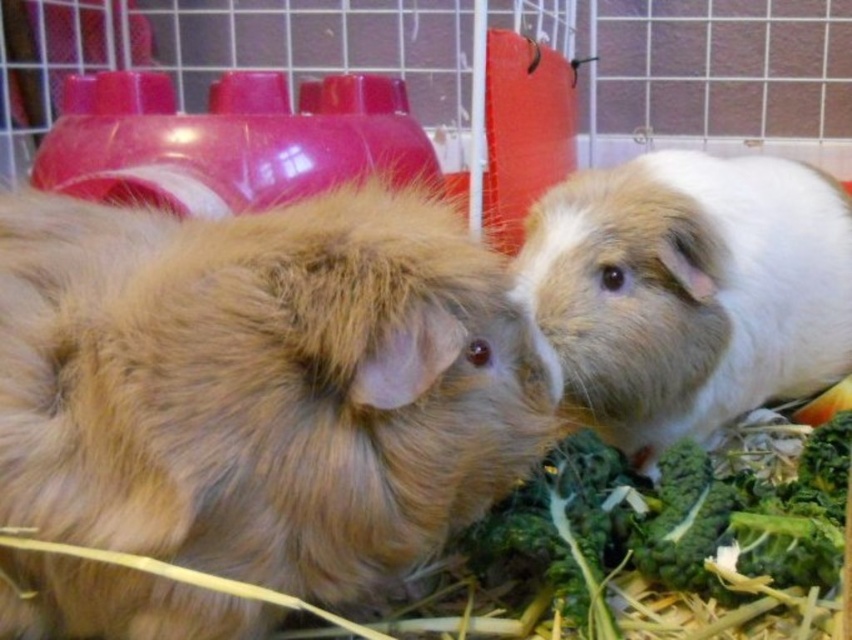
Between fuzzy brown hamster at center and green leafy broccoli at lower right, which one appears on the right side from the viewer's perspective?

Positioned to the right is green leafy broccoli at lower right.

Between fuzzy brown hamster at center and green leafy broccoli at lower right, which one is positioned lower?

green leafy broccoli at lower right is lower down.

The height and width of the screenshot is (640, 852). Describe the element at coordinates (263, 384) in the screenshot. I see `fuzzy brown hamster at center` at that location.

The image size is (852, 640). I want to click on fuzzy brown hamster at center, so click(263, 384).

Does point (547, 259) lie behind point (721, 500)?

Yes, it is behind point (721, 500).

Is the position of white soft hamster at center more distant than that of green leafy broccoli at lower right?

Yes, white soft hamster at center is behind green leafy broccoli at lower right.

Between point (556, 291) and point (676, 554), which one is positioned behind?

The point (556, 291) is behind.

At what (x,y) coordinates should I click in order to perform the action: click on white soft hamster at center. Please return your answer as a coordinate pair (x, y). Looking at the image, I should click on (689, 291).

Does fuzzy brown hamster at center lie behind white soft hamster at center?

No.

Between point (4, 374) and point (780, 164), which one is positioned in front?

Point (4, 374)

At what (x,y) coordinates should I click in order to perform the action: click on fuzzy brown hamster at center. Please return your answer as a coordinate pair (x, y). Looking at the image, I should click on (263, 384).